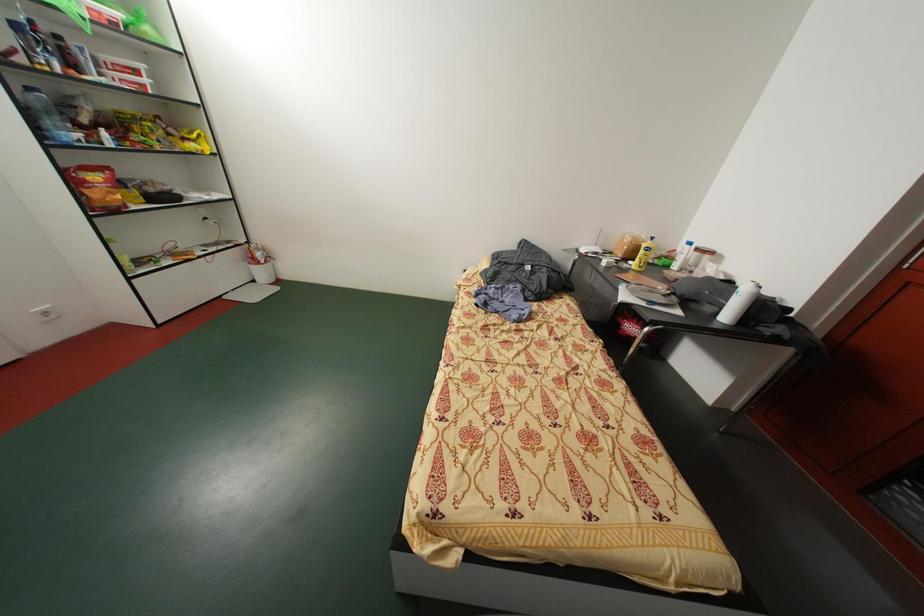
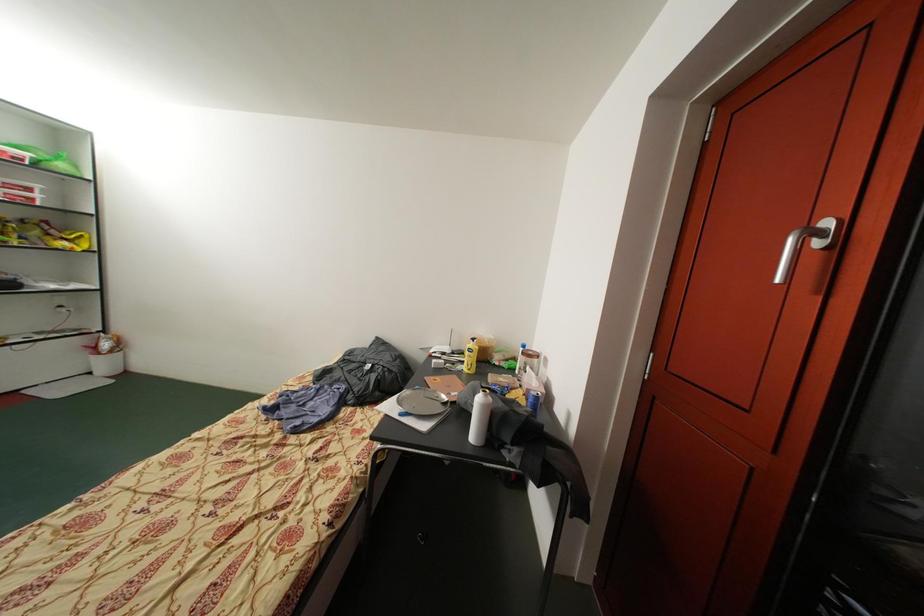
Question: Which direction would the cameraman need to move to produce the second image? Reply with the corresponding letter.

Choices:
 (A) Left
 (B) Right
 (C) Forward
 (D) Backward

Answer: (B)